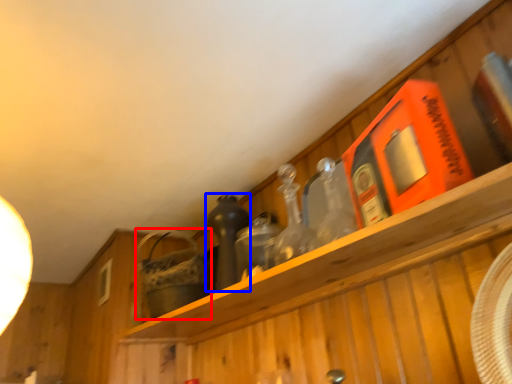
Question: Which object appears farthest to the camera in this image, basket (highlighted by a red box) or bottle (highlighted by a blue box)?

Choices:
 (A) basket
 (B) bottle

Answer: (A)